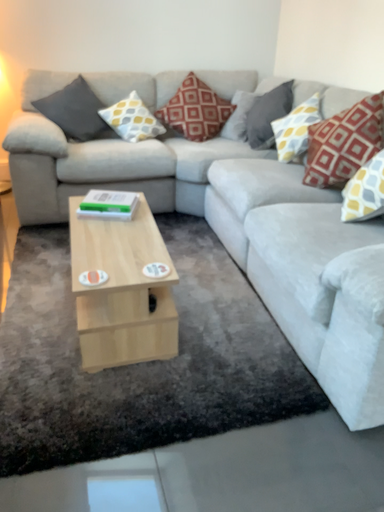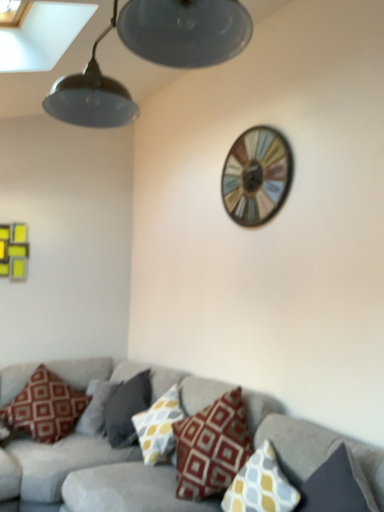
Question: Which way did the camera rotate in the video?

Choices:
 (A) rotated left
 (B) rotated right

Answer: (B)